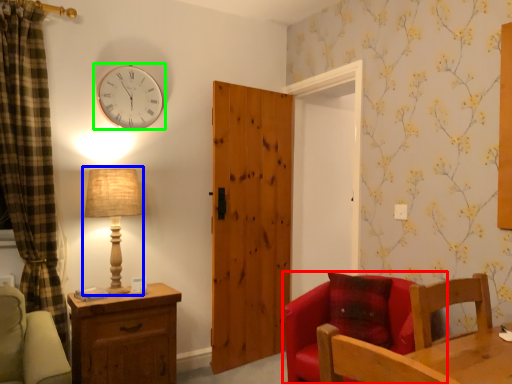
Question: Estimate the real-world distances between objects in this image. Which object is farther from chair (highlighted by a red box), table lamp (highlighted by a blue box) or wall clock (highlighted by a green box)?

Choices:
 (A) table lamp
 (B) wall clock

Answer: (B)